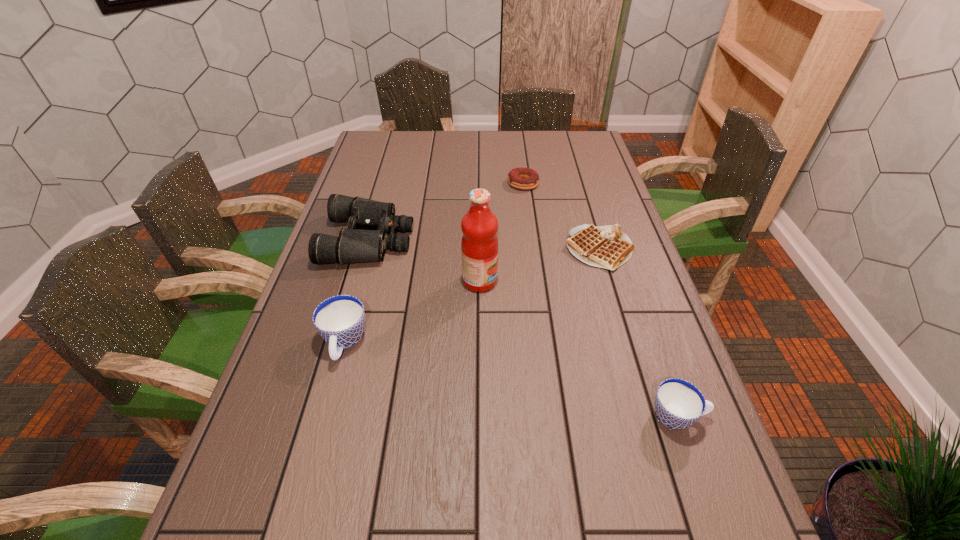
Find the location of a particular element. free location located 0.150m on the side of the taller cup with the handle is located at coordinates (321, 433).

What are the coordinates of `blank area located 0.310m on the back of the fourth object from left to right` in the screenshot? It's located at 516,136.

Locate an element on the screen. Image resolution: width=960 pixels, height=540 pixels. vacant area located on the front label of the tallest object is located at coordinates (633, 281).

Find the location of `vacant space located through the eyepieces of the binoculars`. vacant space located through the eyepieces of the binoculars is located at coordinates (538, 240).

At what (x,y) coordinates should I click in order to perform the action: click on vacant area situated 0.290m on the left of the waffle. Please return your answer as a coordinate pair (x, y). Looking at the image, I should click on (467, 249).

Where is `cup located in the left edge section of the desktop`? Image resolution: width=960 pixels, height=540 pixels. cup located in the left edge section of the desktop is located at coordinates (340, 320).

You are a GUI agent. You are given a task and a screenshot of the screen. Output one action in this format:
    pyautogui.click(x=<x>, y=<y>)
    Task: Click on the binoculars present at the left edge
    This screenshot has width=960, height=540.
    Given the screenshot: What is the action you would take?
    pyautogui.click(x=353, y=245)

At what (x,y) coordinates should I click in order to perform the action: click on cup that is at the right edge. Please return your answer as a coordinate pair (x, y). Looking at the image, I should click on (678, 403).

Identify the location of waffle present at the right edge. The width and height of the screenshot is (960, 540). (608, 247).

In the image, there is a desktop. At what (x,y) coordinates should I click in order to perform the action: click on vacant space at the far edge. Please return your answer as a coordinate pair (x, y). This screenshot has height=540, width=960. Looking at the image, I should click on (481, 132).